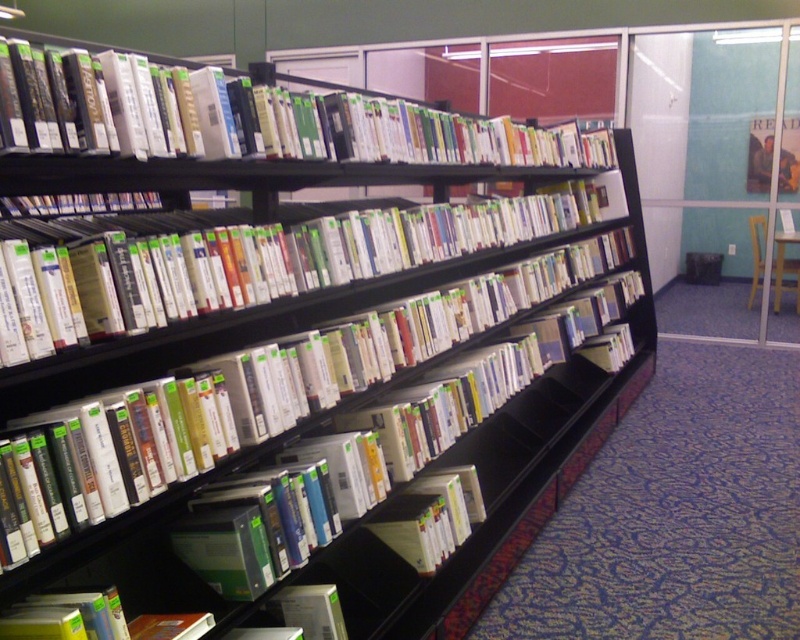
You are standing in front of the curved shelving unit in the library. You notice two points marked on the shelves at coordinates point (68, 72) and point (228, 305). Which point is nearer to your current position?

Point (68, 72) is closer to the camera than point (228, 305), so the point at coordinates point (68, 72) is nearer to your current position.

From the picture: You are a librarian who needs to place a new book that is 12 inches wide. You see the hardcover books at upper center and the hardcover books at center. Can the new book fit between them?

The distance between the hardcover books at upper center and hardcover books at center is 11.52 inches, which is slightly less than the 12 inch width of the new book. Therefore, the new book cannot fit between them.